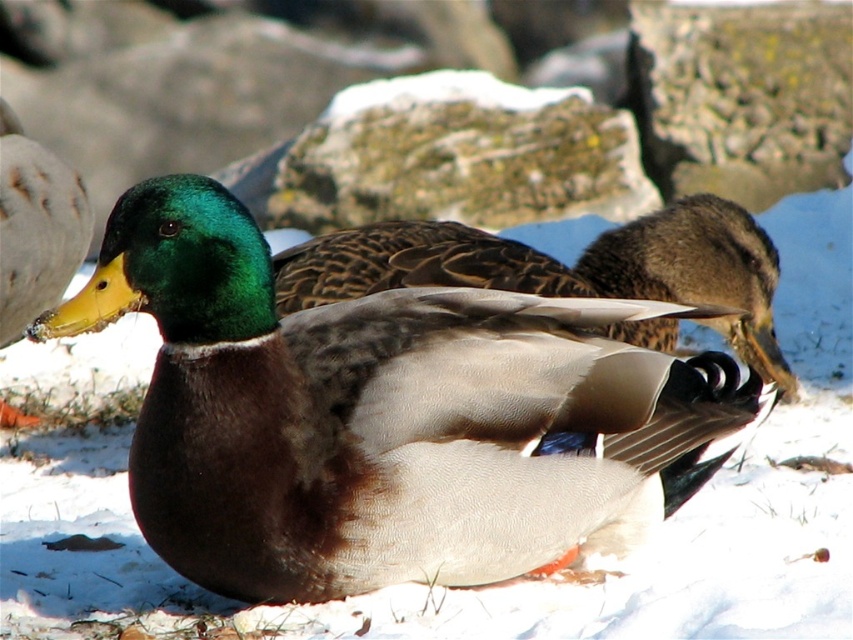
This screenshot has height=640, width=853. I want to click on shiny brown duck at center, so click(386, 416).

Who is taller, shiny brown duck at center or brown textured duck at center?

shiny brown duck at center is taller.

Between point (209, 432) and point (418, 237), which one is positioned behind?

Point (418, 237)

Find the location of `shiny brown duck at center`. shiny brown duck at center is located at coordinates point(386,416).